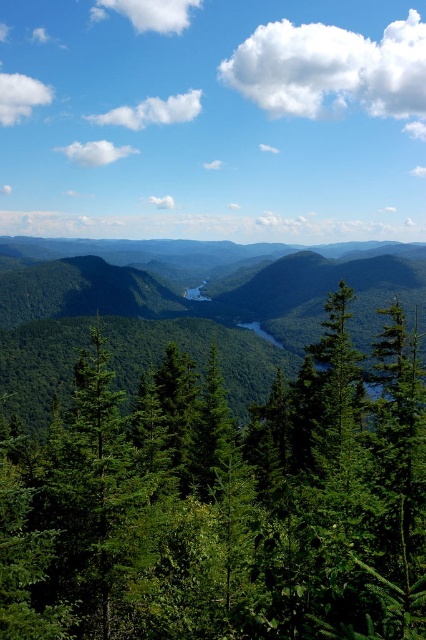
Is point (408, 492) closer to camera compared to point (374, 317)?

That is True.

Between green matte tree at center and green matte forest at center, which one appears on the left side from the viewer's perspective?

green matte tree at center is more to the left.

Is point (356, 456) behind point (249, 285)?

No, (356, 456) is closer to viewer.

Identify the location of green matte tree at center. This screenshot has height=640, width=426. (224, 500).